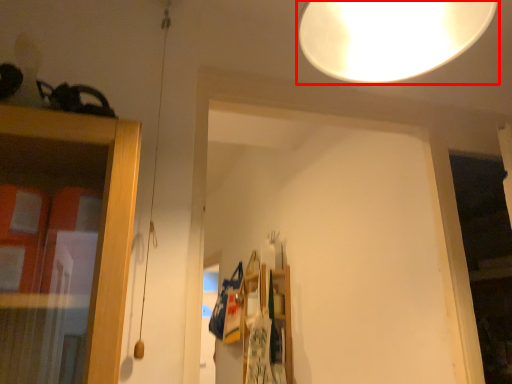
Question: Observing the image, what is the correct spatial positioning of lamp (annotated by the red box) in reference to shelf?

Choices:
 (A) left
 (B) right

Answer: (B)